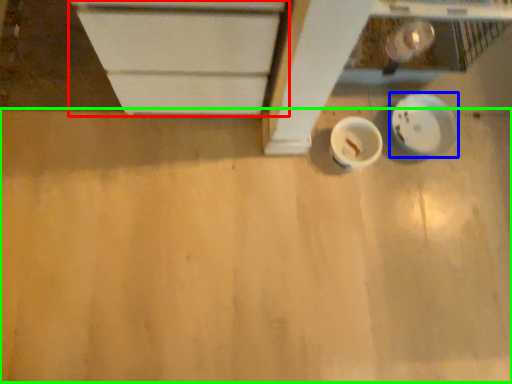
Question: Which object is positioned closest to cabinetry (highlighted by a red box)? Select from plate (highlighted by a blue box) and plywood (highlighted by a green box).

Choices:
 (A) plate
 (B) plywood

Answer: (B)